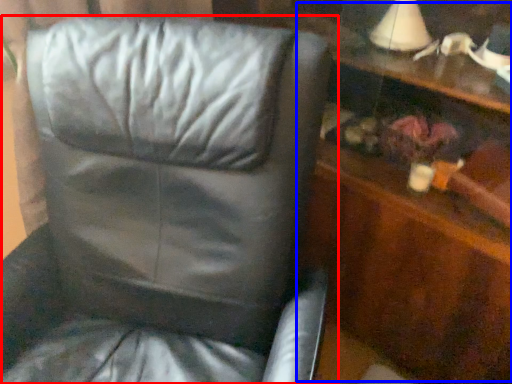
Question: Which point is closer to the camera, chair (highlighted by a red box) or dresser (highlighted by a blue box)?

Choices:
 (A) chair
 (B) dresser

Answer: (A)